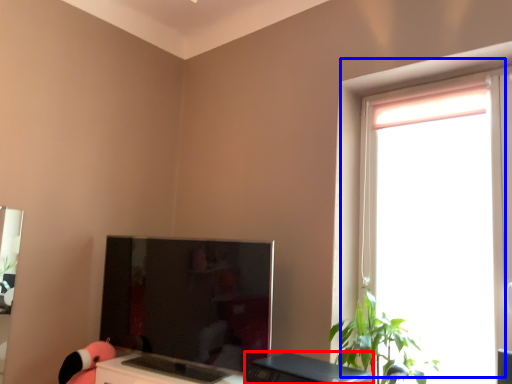
Question: Which of the following is the closest to the observer, desktop (highlighted by a red box) or window (highlighted by a blue box)?

Choices:
 (A) desktop
 (B) window

Answer: (A)